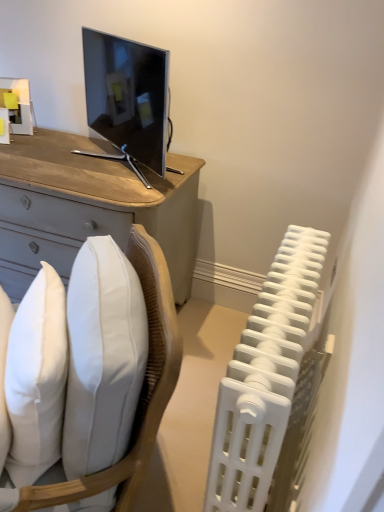
Question: From a real-world perspective, is white fabric chair at lower left physically above white plastic radiator at right?

Choices:
 (A) no
 (B) yes

Answer: (B)

Question: From a real-world perspective, does white fabric chair at lower left sit lower than white plastic radiator at right?

Choices:
 (A) no
 (B) yes

Answer: (A)

Question: Is the position of white fabric chair at lower left less distant than that of white plastic radiator at right?

Choices:
 (A) no
 (B) yes

Answer: (B)

Question: Is white fabric chair at lower left turned away from white plastic radiator at right?

Choices:
 (A) no
 (B) yes

Answer: (B)

Question: Considering the relative sizes of white fabric chair at lower left and white plastic radiator at right in the image provided, is white fabric chair at lower left taller than white plastic radiator at right?

Choices:
 (A) yes
 (B) no

Answer: (A)

Question: In terms of height, does white fabric chair at lower left look taller or shorter compared to white soft pillow at lower left?

Choices:
 (A) tall
 (B) short

Answer: (A)

Question: In terms of width, does white fabric chair at lower left look wider or thinner when compared to white soft pillow at lower left?

Choices:
 (A) thin
 (B) wide

Answer: (B)

Question: Is white fabric chair at lower left situated inside white soft pillow at lower left or outside?

Choices:
 (A) inside
 (B) outside

Answer: (B)

Question: In terms of size, does white fabric chair at lower left appear bigger or smaller than white soft pillow at lower left?

Choices:
 (A) small
 (B) big

Answer: (B)

Question: Is white plastic radiator at right bigger or smaller than white soft pillow at lower left?

Choices:
 (A) big
 (B) small

Answer: (A)

Question: In terms of width, does white plastic radiator at right look wider or thinner when compared to white soft pillow at lower left?

Choices:
 (A) wide
 (B) thin

Answer: (B)

Question: From a real-world perspective, relative to white soft pillow at lower left, is white plastic radiator at right vertically above or below?

Choices:
 (A) above
 (B) below

Answer: (B)

Question: From the image's perspective, relative to white soft pillow at lower left, is white plastic radiator at right above or below?

Choices:
 (A) below
 (B) above

Answer: (A)

Question: In terms of size, does white fabric chair at lower left appear bigger or smaller than white plastic radiator at right?

Choices:
 (A) big
 (B) small

Answer: (A)

Question: Considering their positions, is white fabric chair at lower left located in front of or behind white plastic radiator at right?

Choices:
 (A) front
 (B) behind

Answer: (A)